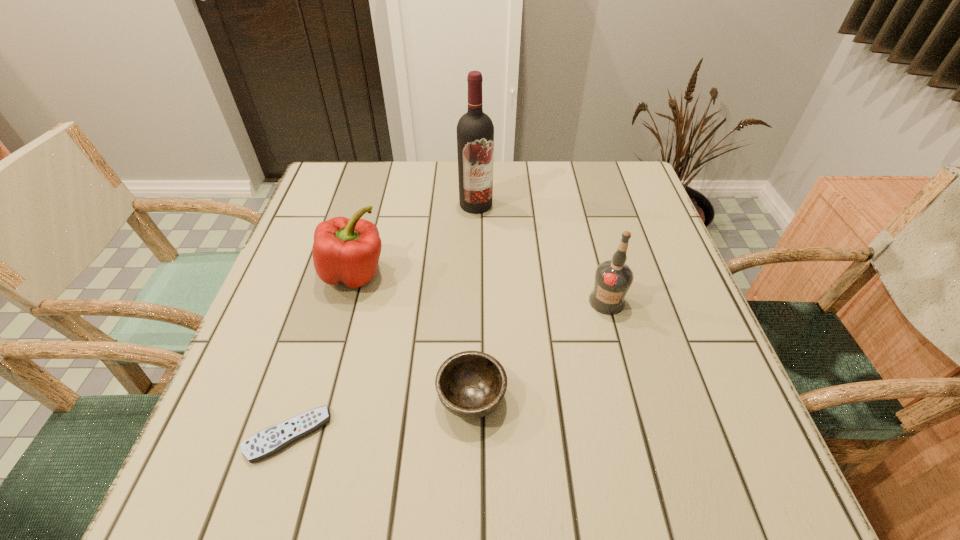
Find the location of `vacant space located 0.060m on the back of the second shortest object`. vacant space located 0.060m on the back of the second shortest object is located at coordinates click(472, 342).

Identify the location of vacant space located on the right of the shortest object. (393, 435).

Where is `object situated at the far edge`? The width and height of the screenshot is (960, 540). object situated at the far edge is located at coordinates (475, 131).

The image size is (960, 540). I want to click on object that is at the near edge, so click(x=265, y=443).

The image size is (960, 540). In order to click on bell pepper at the left edge in this screenshot , I will do `click(347, 251)`.

Where is `remote control positioned at the left edge`? Image resolution: width=960 pixels, height=540 pixels. remote control positioned at the left edge is located at coordinates (265, 443).

Where is `object at the right edge`? object at the right edge is located at coordinates (613, 278).

Locate an element on the screen. object positioned at the near left corner is located at coordinates (265, 443).

Where is `vacant space at the far edge of the desktop`? This screenshot has height=540, width=960. vacant space at the far edge of the desktop is located at coordinates (519, 202).

Find the location of a particular element. Image resolution: width=960 pixels, height=540 pixels. vacant area at the near edge of the desktop is located at coordinates (302, 471).